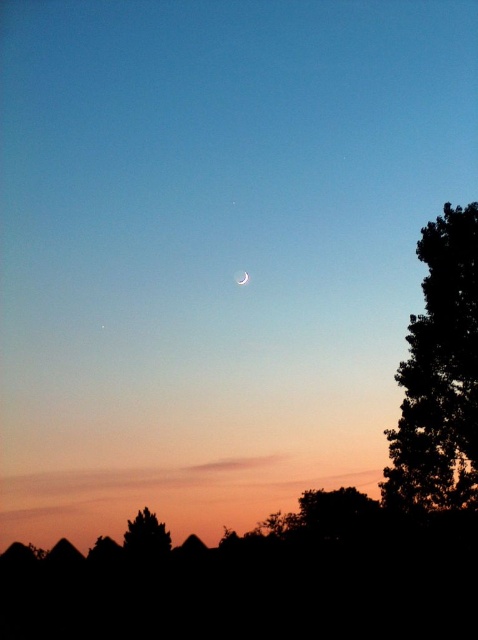
You are planning to install a new streetlight between the silhouette tree at right and the silhouette tree at lower left. The streetlight requires a minimum of 30 meters of space between the two trees to be installed safely. Based on the scene, can you confirm if there is enough space for the streetlight?

The silhouette tree at right and the silhouette tree at lower left are 35.87 meters apart, which exceeds the required 30 meters. Therefore, there is sufficient space to install the streetlight safely between them.